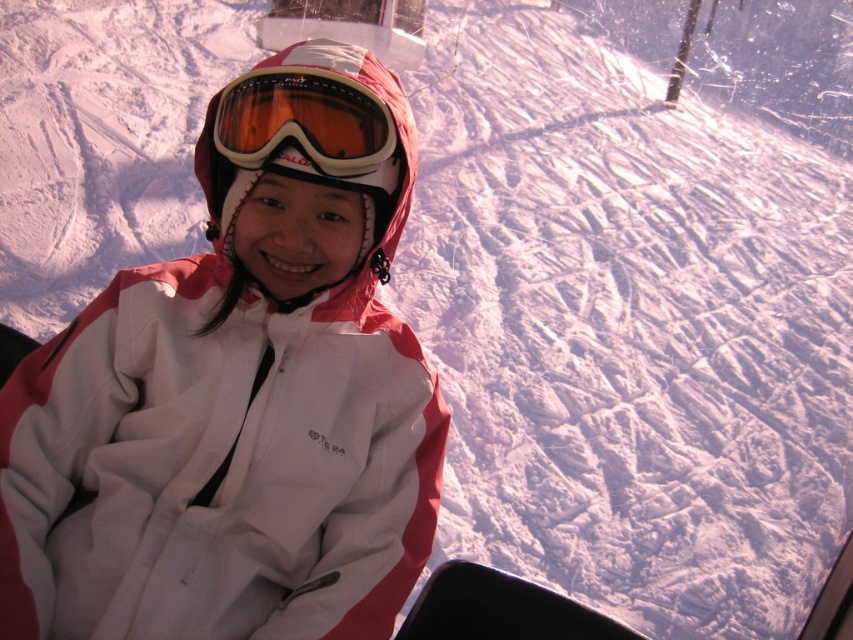
Question: Is matte white helmet at center further to the viewer compared to transparent orange lens goggles at center?

Choices:
 (A) yes
 (B) no

Answer: (A)

Question: Which point is farther from the camera taking this photo?

Choices:
 (A) (343, 600)
 (B) (210, 212)
 (C) (357, 170)

Answer: (B)

Question: Is white/waterproof jacket at center bigger than matte white helmet at center?

Choices:
 (A) no
 (B) yes

Answer: (B)

Question: Which point is closer to the camera taking this photo?

Choices:
 (A) (335, 102)
 (B) (254, 100)

Answer: (A)

Question: Which point appears closest to the camera in this image?

Choices:
 (A) (328, 148)
 (B) (289, 106)
 (C) (328, 108)

Answer: (B)

Question: Does white/waterproof jacket at center appear on the left side of transparent orange lens goggles at center?

Choices:
 (A) no
 (B) yes

Answer: (B)